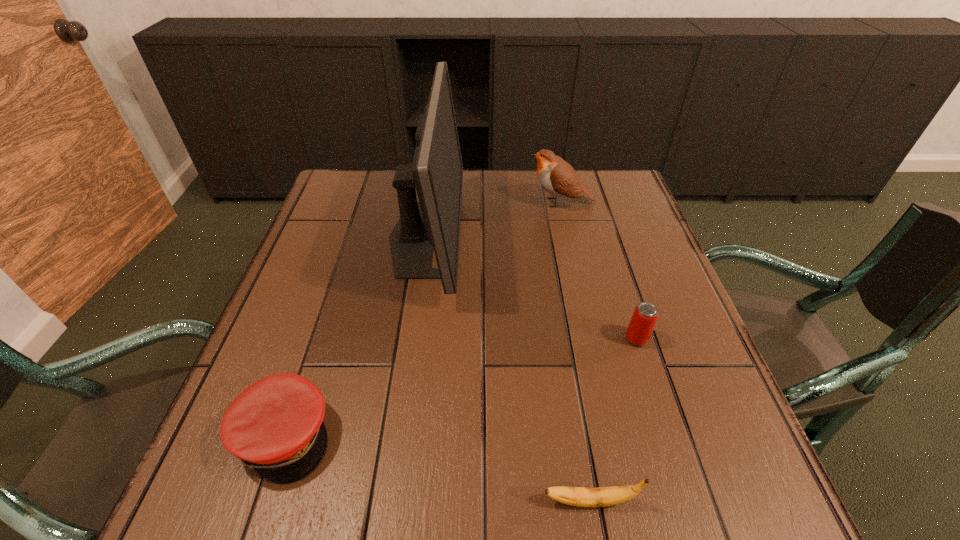
Where is `computer monitor`? The height and width of the screenshot is (540, 960). computer monitor is located at coordinates (436, 171).

You are a GUI agent. You are given a task and a screenshot of the screen. Output one action in this format:
    pyautogui.click(x=<x>, y=<y>)
    Task: Click on the second object from left to right
    This screenshot has width=960, height=540.
    Given the screenshot: What is the action you would take?
    pyautogui.click(x=436, y=171)

The image size is (960, 540). What are the coordinates of `bird` in the screenshot? It's located at pyautogui.click(x=555, y=175).

Find the location of `beer can`. beer can is located at coordinates (644, 318).

Locate an element on the screen. The image size is (960, 540). the nearest object is located at coordinates (576, 496).

The height and width of the screenshot is (540, 960). Find the location of `the fourth farthest object`. the fourth farthest object is located at coordinates (275, 426).

You are a GUI agent. You are given a task and a screenshot of the screen. Output one action in this format:
    pyautogui.click(x=<x>, y=<y>)
    Task: Click on the cap
    
    Given the screenshot: What is the action you would take?
    pyautogui.click(x=275, y=426)

The height and width of the screenshot is (540, 960). In order to click on vacant space located 0.080m on the screen side of the tallest object in this screenshot , I will do `click(492, 238)`.

Where is `vacant region located 0.360m at the face of the bird`? The height and width of the screenshot is (540, 960). vacant region located 0.360m at the face of the bird is located at coordinates 399,202.

Identify the location of free space located 0.230m at the face of the bird. The height and width of the screenshot is (540, 960). (445, 202).